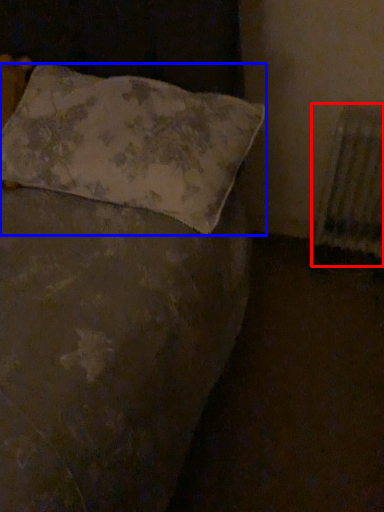
Question: Which object appears farthest to the camera in this image, radiator (highlighted by a red box) or pillow (highlighted by a blue box)?

Choices:
 (A) radiator
 (B) pillow

Answer: (A)